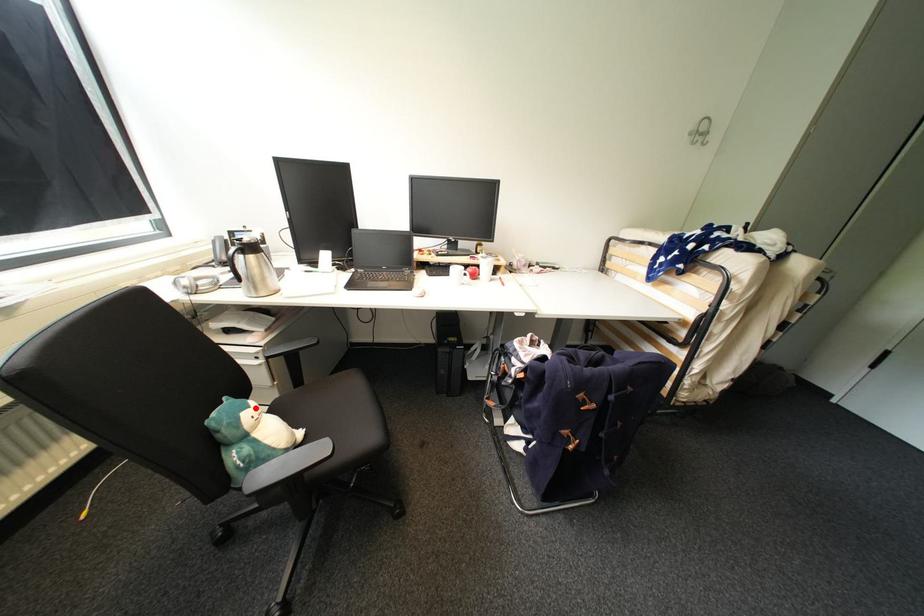
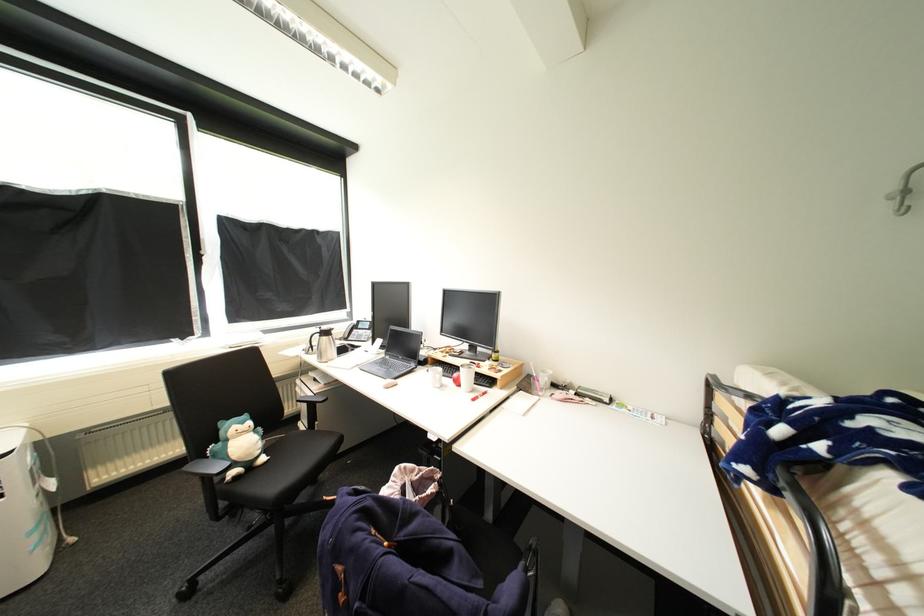
Locate, in the second image, the point that corresponds to the highlighted location in the first image.

(249, 424)